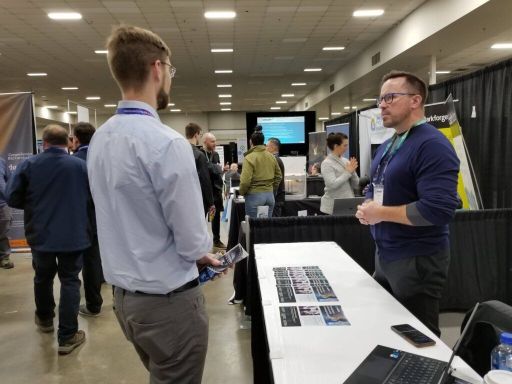
The image size is (512, 384). Identify the location of floor. (105, 342).